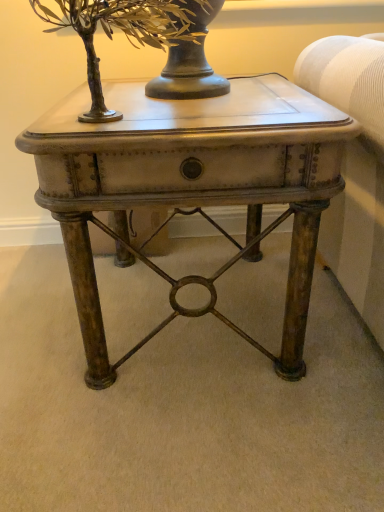
Where is `vacant area to the right of green metallic tree at upper center`? vacant area to the right of green metallic tree at upper center is located at coordinates (253, 106).